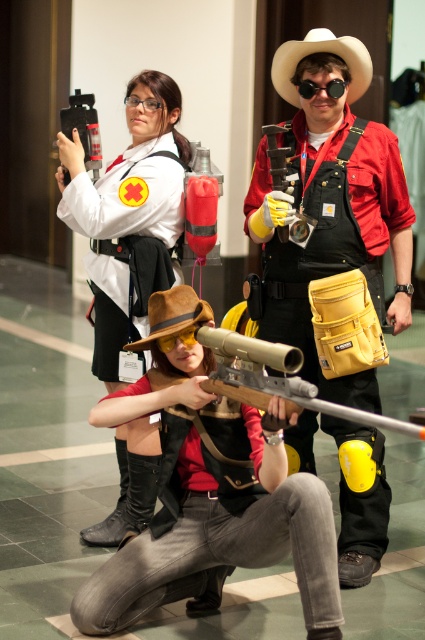
Question: Estimate the real-world distances between objects in this image. Which object is farther from the matte silver rifle at center?

Choices:
 (A) black matte goggles at upper center
 (B) brown felt cowboy hat at center

Answer: (A)

Question: Which point is farther to the camera?

Choices:
 (A) (314, 88)
 (B) (351, 42)
 (C) (308, 52)
 (D) (187, 296)

Answer: (C)

Question: Can you confirm if matte silver rifle at center is wider than black matte goggles at upper center?

Choices:
 (A) no
 (B) yes

Answer: (B)

Question: Which object is the closest to the brown felt cowboy hat at center?

Choices:
 (A) reddish-brown leather vest at center
 (B) white matte cowboy hat at upper center
 (C) black matte goggles at upper center
 (D) matte silver rifle at center

Answer: (D)

Question: Is reddish-brown leather vest at center wider than matte white shirt at upper left?

Choices:
 (A) no
 (B) yes

Answer: (B)

Question: Observing the image, what is the correct spatial positioning of white matte cowboy hat at upper center in reference to brown felt cowboy hat at center?

Choices:
 (A) above
 (B) below

Answer: (A)